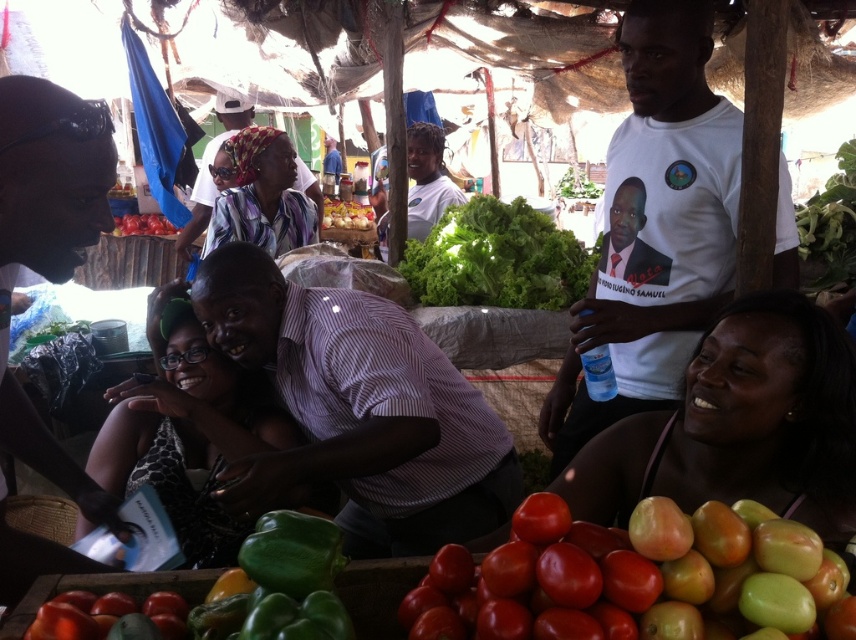
You are a customer at the market stall. You see the smooth skin woman at lower right and the green leafy at upper right. Which one is positioned higher in the image?

The green leafy at upper right is positioned higher in the image than the smooth skin woman at lower right.

You are standing at the entrance of the market stall and see a point marked at coordinates (x=497, y=259). What object is located at that point?

The point at coordinates (x=497, y=259) marks the green leafy lettuce at center.

You are standing in front of the market stall and want to pick up an item from the table. There are two points on the table where items are placed. The first point is at coordinates point [794,328] and the second is at point [819,230]. Which point is closer to you?

Point [794,328] is closer to the viewer than point [819,230], so you should reach for the item at point [794,328] first as it is nearer to your position.